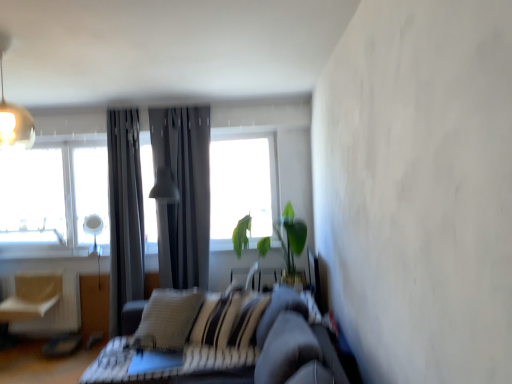
Question: Are light beige fabric swivel chair at left and matte gray lampshade at center, arranged as the 2th light fixture when viewed from the top, far apart?

Choices:
 (A) no
 (B) yes

Answer: (B)

Question: From a real-world perspective, does light beige fabric swivel chair at left sit lower than matte gray lampshade at center, the 2th light fixture from the front?

Choices:
 (A) no
 (B) yes

Answer: (B)

Question: Considering the relative sizes of light beige fabric swivel chair at left and matte gray lampshade at center, the 2th light fixture from the front, in the image provided, is light beige fabric swivel chair at left bigger than matte gray lampshade at center, the 2th light fixture from the front,?

Choices:
 (A) no
 (B) yes

Answer: (A)

Question: Could you tell me if light beige fabric swivel chair at left is facing matte gray lampshade at center, which is the 1th light fixture in back-to-front order?

Choices:
 (A) no
 (B) yes

Answer: (A)

Question: Considering the relative sizes of light beige fabric swivel chair at left and matte gray lampshade at center, the first light fixture from the right, in the image provided, is light beige fabric swivel chair at left shorter than matte gray lampshade at center, the first light fixture from the right,?

Choices:
 (A) no
 (B) yes

Answer: (B)

Question: From a real-world perspective, relative to light beige fabric swivel chair at left, is metallic pendant light at upper left, the second light fixture when ordered from back to front, vertically above or below?

Choices:
 (A) below
 (B) above

Answer: (B)

Question: Is metallic pendant light at upper left, the 2th light fixture in the bottom-to-top sequence, bigger or smaller than light beige fabric swivel chair at left?

Choices:
 (A) big
 (B) small

Answer: (B)

Question: Relative to light beige fabric swivel chair at left, is metallic pendant light at upper left, arranged as the first light fixture when viewed from the left, in front or behind?

Choices:
 (A) behind
 (B) front

Answer: (B)

Question: From the image's perspective, is metallic pendant light at upper left, which appears as the 1th light fixture when viewed from the front, positioned above or below light beige fabric swivel chair at left?

Choices:
 (A) below
 (B) above

Answer: (B)

Question: From their relative heights in the image, would you say dark gray leather couch at center is taller or shorter than green leafy plant at center?

Choices:
 (A) tall
 (B) short

Answer: (A)

Question: From the image's perspective, is dark gray leather couch at center above or below green leafy plant at center?

Choices:
 (A) above
 (B) below

Answer: (B)

Question: Does point (291, 292) appear closer or farther from the camera than point (245, 241)?

Choices:
 (A) closer
 (B) farther

Answer: (A)

Question: Relative to green leafy plant at center, is dark gray leather couch at center in front or behind?

Choices:
 (A) behind
 (B) front

Answer: (B)

Question: From a real-world perspective, is matte gray lampshade at center, acting as the 1th light fixture starting from the bottom, positioned above or below green leafy plant at center?

Choices:
 (A) below
 (B) above

Answer: (B)

Question: From their relative heights in the image, would you say matte gray lampshade at center, which is the 1th light fixture in back-to-front order, is taller or shorter than green leafy plant at center?

Choices:
 (A) tall
 (B) short

Answer: (A)